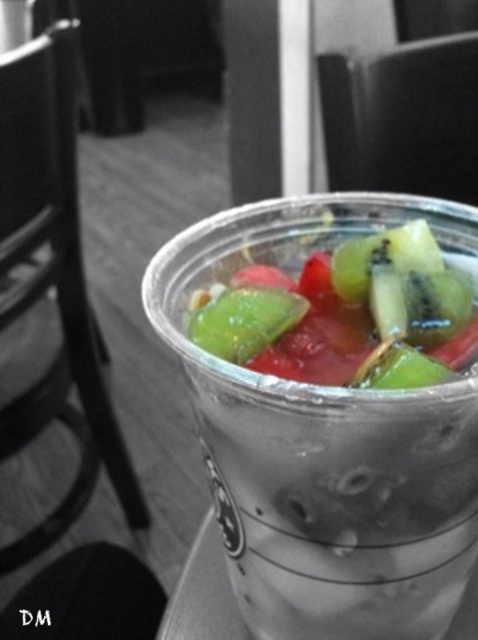
Question: Is translucent plastic fruit salad at center positioned in front of green matte kiwi at center?

Choices:
 (A) yes
 (B) no

Answer: (A)

Question: Is transparent plastic cup at center positioned in front of translucent plastic fruit salad at center?

Choices:
 (A) yes
 (B) no

Answer: (A)

Question: Which of these objects is positioned farthest from the transparent plastic cup at center?

Choices:
 (A) green matte kiwi at center
 (B) translucent plastic fruit salad at center

Answer: (A)

Question: Which point appears farthest from the camera in this image?

Choices:
 (A) (188, 320)
 (B) (473, 269)

Answer: (B)

Question: Is translucent plastic fruit salad at center bigger than green matte kiwi at center?

Choices:
 (A) yes
 (B) no

Answer: (A)

Question: Estimate the real-world distances between objects in this image. Which object is farther from the transparent plastic cup at center?

Choices:
 (A) translucent plastic fruit salad at center
 (B) green matte kiwi at center

Answer: (B)